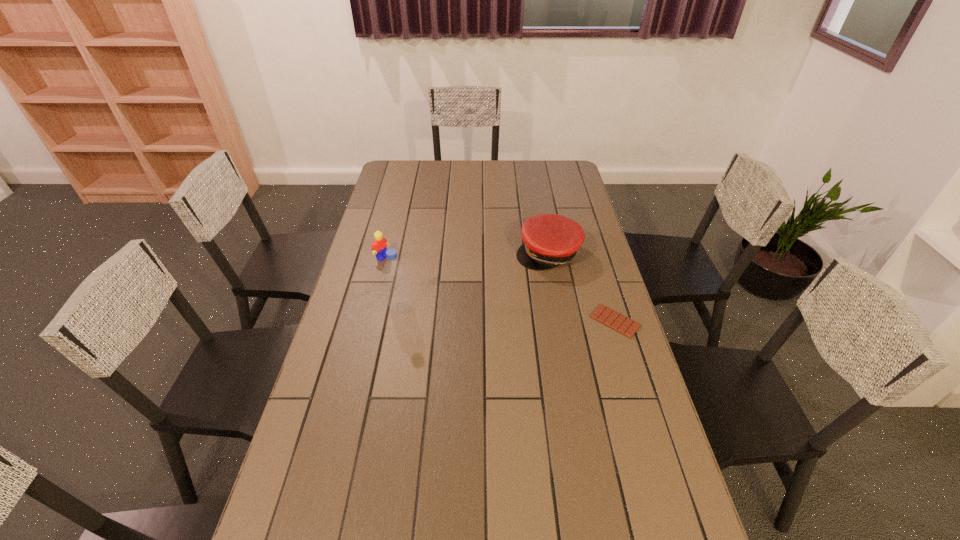
In the image, there is a desktop. Identify the location of free space at the right edge. The width and height of the screenshot is (960, 540). (569, 274).

You are a GUI agent. You are given a task and a screenshot of the screen. Output one action in this format:
    pyautogui.click(x=<x>, y=<y>)
    Task: Click on the free space at the far left corner of the desktop
    
    Given the screenshot: What is the action you would take?
    pyautogui.click(x=401, y=179)

Image resolution: width=960 pixels, height=540 pixels. I want to click on free spot at the near right corner of the desktop, so click(x=652, y=526).

Where is `unoccupied position between the Lego and the candy bar`? unoccupied position between the Lego and the candy bar is located at coordinates (498, 289).

Find the location of a particular element. The height and width of the screenshot is (540, 960). vacant area between the candy bar and the cap is located at coordinates (582, 287).

I want to click on free space between the cap and the Lego, so click(x=466, y=255).

Image resolution: width=960 pixels, height=540 pixels. I want to click on unoccupied position between the leftmost object and the cap, so click(x=466, y=255).

Where is `empty space between the cap and the shortest object`? The width and height of the screenshot is (960, 540). empty space between the cap and the shortest object is located at coordinates (582, 287).

This screenshot has height=540, width=960. In order to click on vacant region between the cap and the tallest object in this screenshot , I will do tap(474, 281).

Find the location of a particular element. This screenshot has height=540, width=960. blank region between the cap and the second object from left to right is located at coordinates (474, 281).